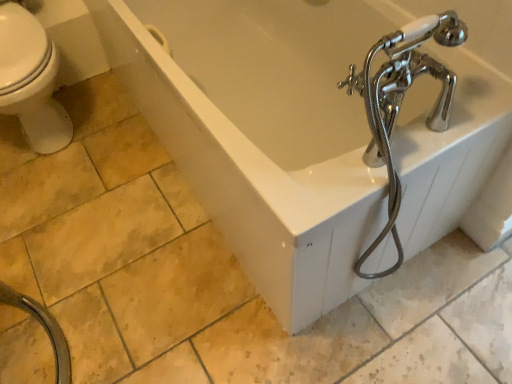
In order to face black rubber garden hose at lower left, should I rotate leftwards or rightwards?

You should look left and rotate roughly 32.035 degrees.

Find the location of a particular element. black rubber garden hose at lower left is located at coordinates tap(44, 328).

The width and height of the screenshot is (512, 384). What do you see at coordinates (44, 328) in the screenshot?
I see `black rubber garden hose at lower left` at bounding box center [44, 328].

What are the coordinates of `white glossy bathtub at center` in the screenshot? It's located at (264, 130).

Describe the element at coordinates (264, 130) in the screenshot. The width and height of the screenshot is (512, 384). I see `white glossy bathtub at center` at that location.

Identify the location of black rubber garden hose at lower left. (44, 328).

Which is more to the left, white glossy bathtub at center or black rubber garden hose at lower left?

From the viewer's perspective, black rubber garden hose at lower left appears more on the left side.

Is white glossy bathtub at center in front of or behind black rubber garden hose at lower left in the image?

In the image, white glossy bathtub at center appears behind black rubber garden hose at lower left.

Considering the positions of point (194, 169) and point (34, 314), is point (194, 169) closer or farther from the camera than point (34, 314)?

Point (194, 169) is closer to the camera than point (34, 314).

From the image's perspective, is white glossy bathtub at center on black rubber garden hose at lower left?

Yes, from the image's perspective, white glossy bathtub at center is above black rubber garden hose at lower left.

From a real-world perspective, who is located higher, white glossy bathtub at center or black rubber garden hose at lower left?

white glossy bathtub at center.

Looking at this image, is white glossy bathtub at center wider than black rubber garden hose at lower left?

Yes, white glossy bathtub at center is wider than black rubber garden hose at lower left.

Is white glossy bathtub at center taller or shorter than black rubber garden hose at lower left?

In the image, white glossy bathtub at center appears to be taller than black rubber garden hose at lower left.

Does white glossy bathtub at center have a larger size compared to black rubber garden hose at lower left?

Yes, white glossy bathtub at center is bigger than black rubber garden hose at lower left.

Would you say white glossy bathtub at center is outside black rubber garden hose at lower left?

Yes.

Is white glossy bathtub at center placed right next to black rubber garden hose at lower left?

No.

Is white glossy bathtub at center oriented towards black rubber garden hose at lower left?

Yes, white glossy bathtub at center is facing black rubber garden hose at lower left.

This screenshot has height=384, width=512. I want to click on garden hose that appears below the white glossy bathtub at center (from a real-world perspective), so click(x=44, y=328).

Is black rubber garden hose at lower left to the left of white glossy bathtub at center from the viewer's perspective?

Indeed, black rubber garden hose at lower left is positioned on the left side of white glossy bathtub at center.

Which is behind, black rubber garden hose at lower left or white glossy bathtub at center?

white glossy bathtub at center is further away from the camera.

Considering the points (51, 315) and (340, 143), which point is behind, point (51, 315) or point (340, 143)?

The point (340, 143) is farther from the camera.

From the image's perspective, is black rubber garden hose at lower left located above or below white glossy bathtub at center?

black rubber garden hose at lower left is below white glossy bathtub at center.

From a real-world perspective, between black rubber garden hose at lower left and white glossy bathtub at center, who is vertically lower?

From a 3D spatial view, black rubber garden hose at lower left is below.

Considering the sizes of objects black rubber garden hose at lower left and white glossy bathtub at center in the image provided, who is thinner, black rubber garden hose at lower left or white glossy bathtub at center?

black rubber garden hose at lower left.

Which of these two, black rubber garden hose at lower left or white glossy bathtub at center, stands taller?

With more height is white glossy bathtub at center.

Based on the photo, which of these two, black rubber garden hose at lower left or white glossy bathtub at center, is smaller?

Smaller between the two is black rubber garden hose at lower left.

Is black rubber garden hose at lower left not within white glossy bathtub at center?

That's correct, black rubber garden hose at lower left is outside of white glossy bathtub at center.

Is black rubber garden hose at lower left in contact with white glossy bathtub at center?

black rubber garden hose at lower left and white glossy bathtub at center are not in contact.

Is black rubber garden hose at lower left facing towards white glossy bathtub at center?

Yes, black rubber garden hose at lower left is oriented towards white glossy bathtub at center.

Can you tell me how much black rubber garden hose at lower left and white glossy bathtub at center differ in facing direction?

They differ by 179 degrees in their facing directions.

The height and width of the screenshot is (384, 512). What are the coordinates of `garden hose that is in front of the white glossy bathtub at center` in the screenshot? It's located at (44, 328).

Identify the location of bathtub that is on the right side of black rubber garden hose at lower left. (264, 130).

At what (x,y) coordinates should I click in order to perform the action: click on garden hose in front of the white glossy bathtub at center. Please return your answer as a coordinate pair (x, y). The height and width of the screenshot is (384, 512). Looking at the image, I should click on (44, 328).